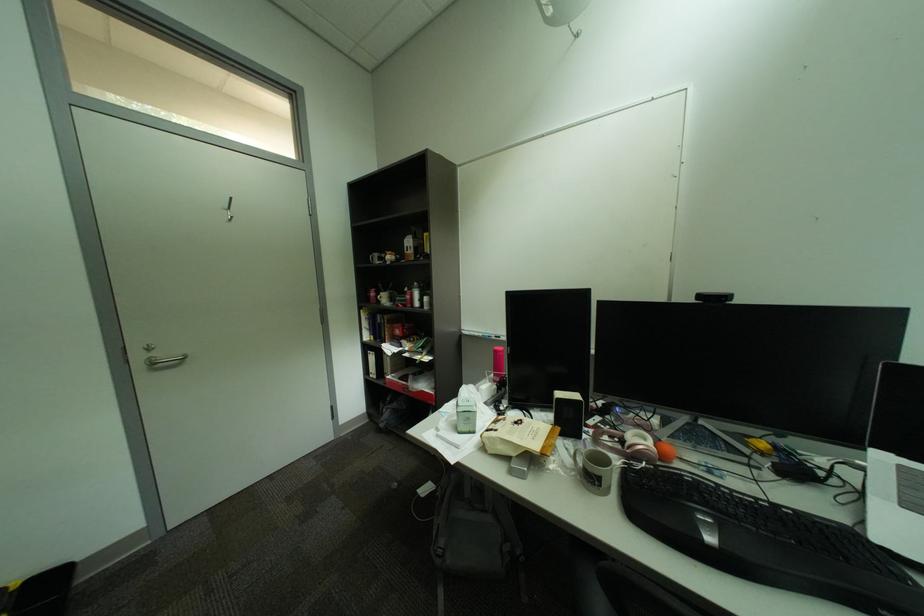
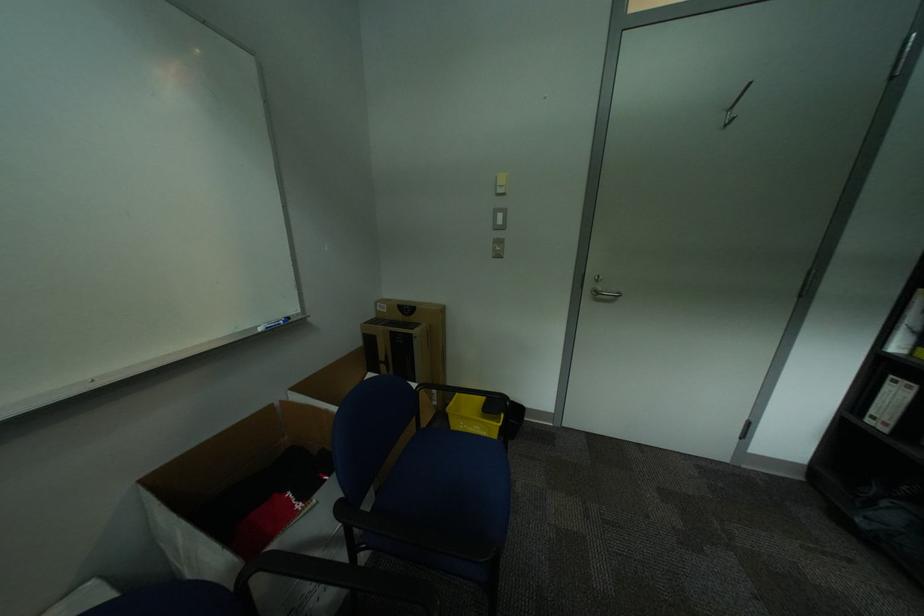
Locate, in the second image, the point that corresponds to (x=164, y=363) in the first image.

(606, 294)